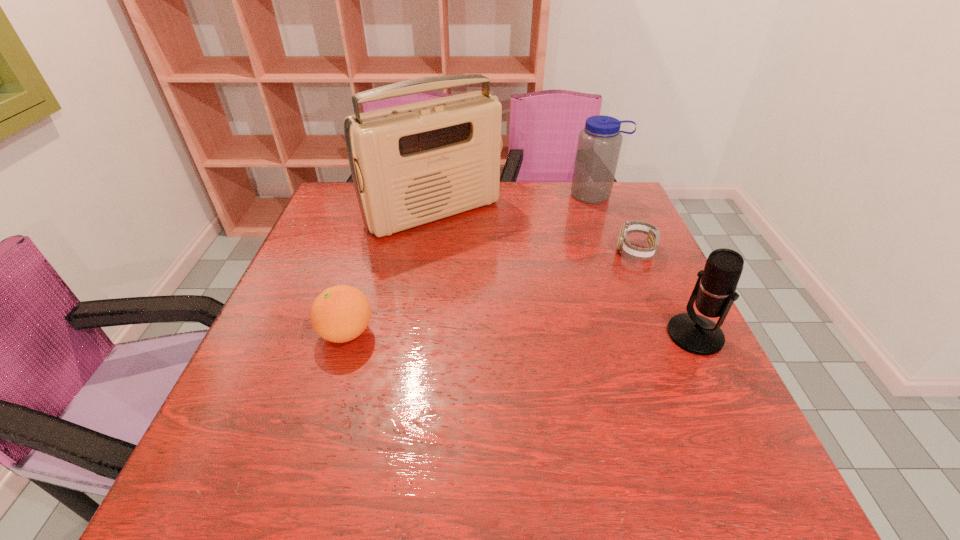
Locate an element on the screen. the second shortest object is located at coordinates (341, 313).

At what (x,y) coordinates should I click in order to perform the action: click on microphone. Please return your answer as a coordinate pair (x, y). Looking at the image, I should click on (714, 293).

This screenshot has width=960, height=540. What are the coordinates of `radio receiver` in the screenshot? It's located at (412, 164).

Locate an element on the screen. The height and width of the screenshot is (540, 960). the shortest object is located at coordinates (624, 247).

This screenshot has width=960, height=540. In order to click on water bottle in this screenshot , I will do `click(599, 143)`.

The width and height of the screenshot is (960, 540). What are the coordinates of `vacant space located on the right of the orange` in the screenshot? It's located at (524, 333).

Identify the location of vacant space located on the back of the microphone. This screenshot has height=540, width=960. (654, 250).

At what (x,y) coordinates should I click in order to perform the action: click on blank area located 0.260m on the front-facing side of the tallest object. Please return your answer as a coordinate pair (x, y). Looking at the image, I should click on (520, 293).

Find the location of a particular element. This screenshot has height=540, width=960. vacant space located on the front-facing side of the tallest object is located at coordinates (488, 259).

Identify the location of vacant space located 0.360m on the front-facing side of the tallest object. Image resolution: width=960 pixels, height=540 pixels. (546, 320).